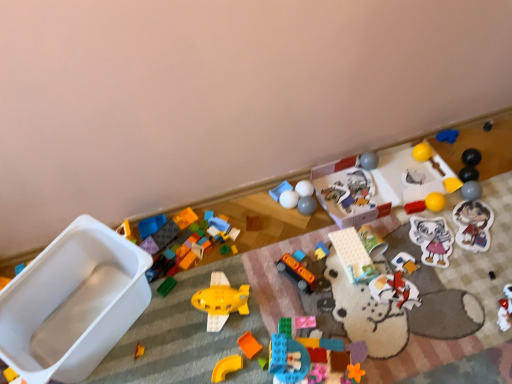
The image size is (512, 384). Find the location of `free space that is in between white matte figure at center, placed as the seventh toy when sorted from right to left, and orange matte bus at center, the tenth toy when ordered from left to right`. free space that is in between white matte figure at center, placed as the seventh toy when sorted from right to left, and orange matte bus at center, the tenth toy when ordered from left to right is located at coordinates (346, 281).